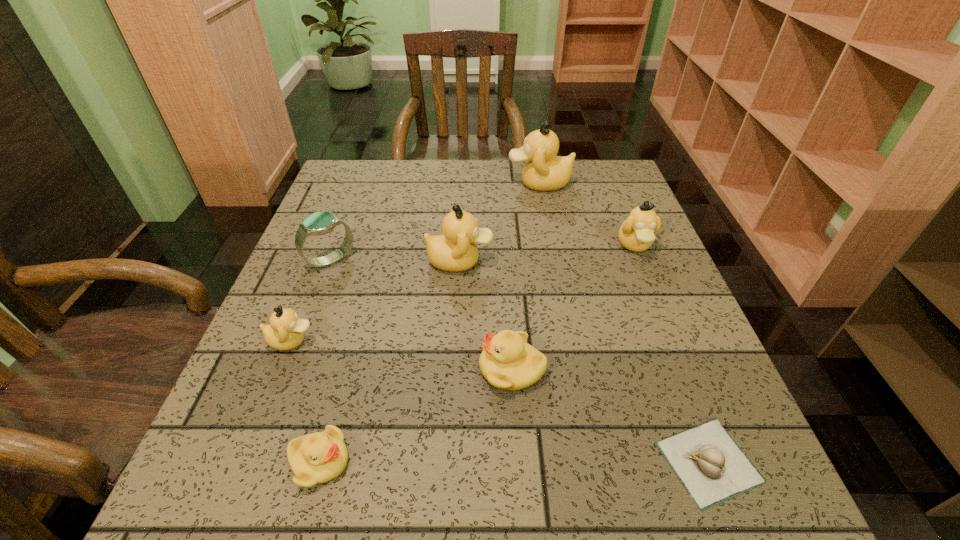
Locate which object is the fourth closest to the watch. Please provide its 2D coordinates. Your answer should be formatted as a tuple, i.e. [(x, y)], where the tuple contains the x and y coordinates of a point satisfying the conditions above.

[(319, 457)]

Identify which object is located as the seventh nearest to the blue watch. Please provide its 2D coordinates. Your answer should be formatted as a tuple, i.e. [(x, y)], where the tuple contains the x and y coordinates of a point satisfying the conditions above.

[(711, 466)]

Locate an element on the screen. duckling that stands as the third closest to the biggest tan duckling is located at coordinates (507, 361).

Where is `duckling that is the fifth closest to the watch`? The image size is (960, 540). duckling that is the fifth closest to the watch is located at coordinates (544, 171).

Identify which tan duckling is the second nearest to the rightmost tan duckling. Please provide its 2D coordinates. Your answer should be formatted as a tuple, i.e. [(x, y)], where the tuple contains the x and y coordinates of a point satisfying the conditions above.

[(455, 250)]

The height and width of the screenshot is (540, 960). Find the location of `tan duckling that is the fourth closest one to the garlic`. tan duckling that is the fourth closest one to the garlic is located at coordinates (544, 171).

The width and height of the screenshot is (960, 540). In order to click on vacant area in the image that satisfies the following two spatial constraints: 1. at the face of the shortest object; 2. on the left side of the bigger yellow duckling in this screenshot , I will do `click(518, 462)`.

You are a GUI agent. You are given a task and a screenshot of the screen. Output one action in this format:
    pyautogui.click(x=<x>, y=<y>)
    Task: Click on the free region that satisfies the following two spatial constraints: 1. at the face of the shortest duckling; 2. on the left side of the garlic
    
    Given the screenshot: What is the action you would take?
    pyautogui.click(x=320, y=462)

At what (x,y) coordinates should I click in order to perform the action: click on vacant area that satisfies the following two spatial constraints: 1. on the face of the shortest object; 2. on the left side of the tallest object. Please return your answer as a coordinate pair (x, y). This screenshot has height=540, width=960. Looking at the image, I should click on (591, 462).

This screenshot has width=960, height=540. Identify the location of free space that satisfies the following two spatial constraints: 1. at the face of the shortest object; 2. on the left side of the right yellow duckling. (518, 462).